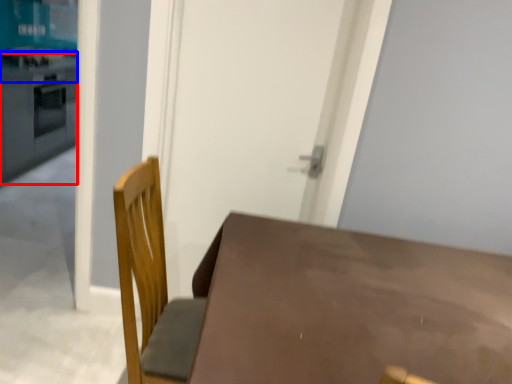
Question: Which point is further to the camera, counter top (highlighted by a red box) or counter top (highlighted by a blue box)?

Choices:
 (A) counter top
 (B) counter top

Answer: (B)